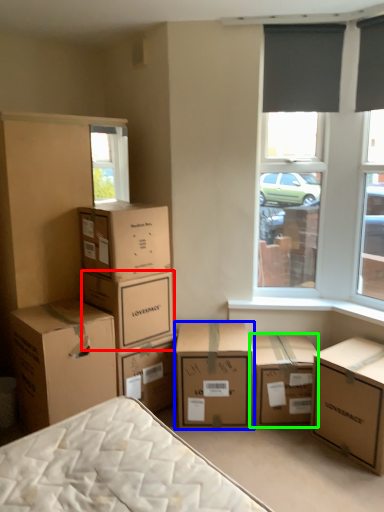
Question: Estimate the real-world distances between objects in this image. Which object is closer to box (highlighted by a red box), box (highlighted by a blue box) or box (highlighted by a green box)?

Choices:
 (A) box
 (B) box

Answer: (A)